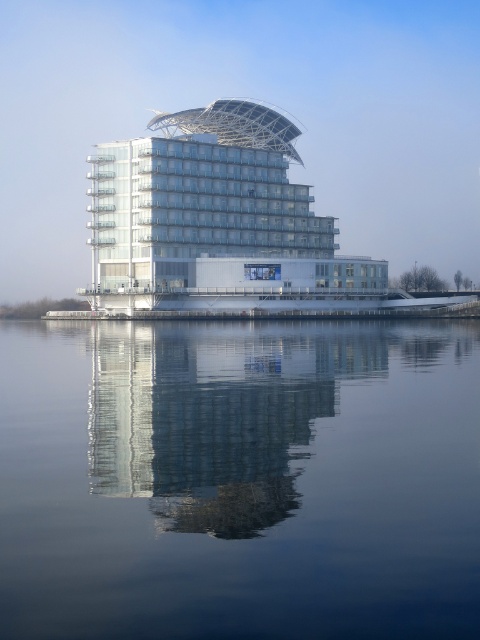
Is transparent glass water at center thinner than smooth glass building at center?

In fact, transparent glass water at center might be wider than smooth glass building at center.

Who is positioned more to the right, transparent glass water at center or smooth glass building at center?

From the viewer's perspective, transparent glass water at center appears more on the right side.

Between point (284, 598) and point (282, 406), which one is positioned behind?

Point (282, 406)

The height and width of the screenshot is (640, 480). I want to click on transparent glass water at center, so click(240, 480).

Measure the distance between point (56, 464) and camera.

Point (56, 464) is 15.08 meters from camera.

Measure the distance between transparent glass water at center and camera.

The distance of transparent glass water at center from camera is 7.14 meters.

This screenshot has width=480, height=640. Find the location of `transparent glass water at center`. transparent glass water at center is located at coordinates click(x=240, y=480).

Which is more to the right, smooth glass building at center or white glass building at center?

Positioned to the right is smooth glass building at center.

Between smooth glass building at center and white glass building at center, which one is positioned lower?

smooth glass building at center is lower down.

Which is behind, point (133, 493) or point (165, 131)?

The point (165, 131) is more distant.

Locate an element on the screen. This screenshot has width=480, height=640. smooth glass building at center is located at coordinates [216, 416].